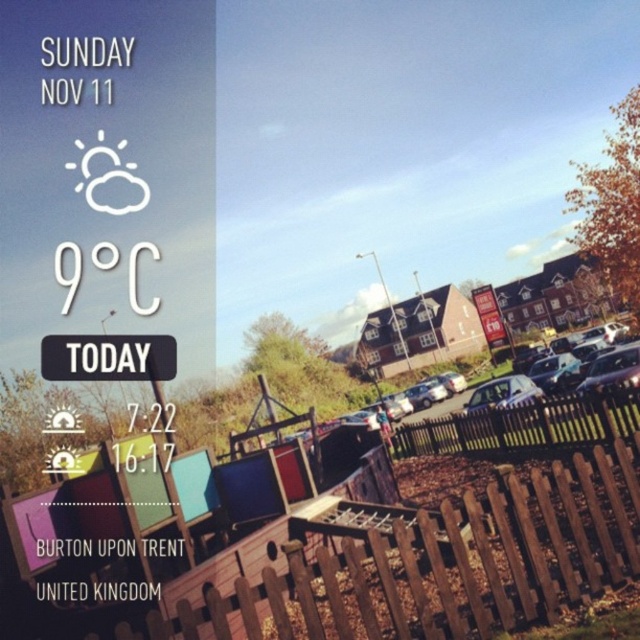
You are standing at the center of the image and want to locate the brown wooden fence at lower right. Based on the coordinates provided, in which direction should you look to find it?

The brown wooden fence at lower right is located at coordinates point (444, 564), so you should look to the lower right direction to find it.

You are standing in the scenic outdoor view on the right side of the image. You see a brown wooden fence at lower right and a black plastic sign at center. Which object is positioned more to the east? Please explain your reasoning based on the sunrise and sunset times shown on the left side of the image.

The sunrise time is 7.22 and sunset is 16.17. Since the sun rises in the east, the black plastic sign at center is positioned more to the east because it is located to the left of the brown wooden fence at lower right, which is further east.